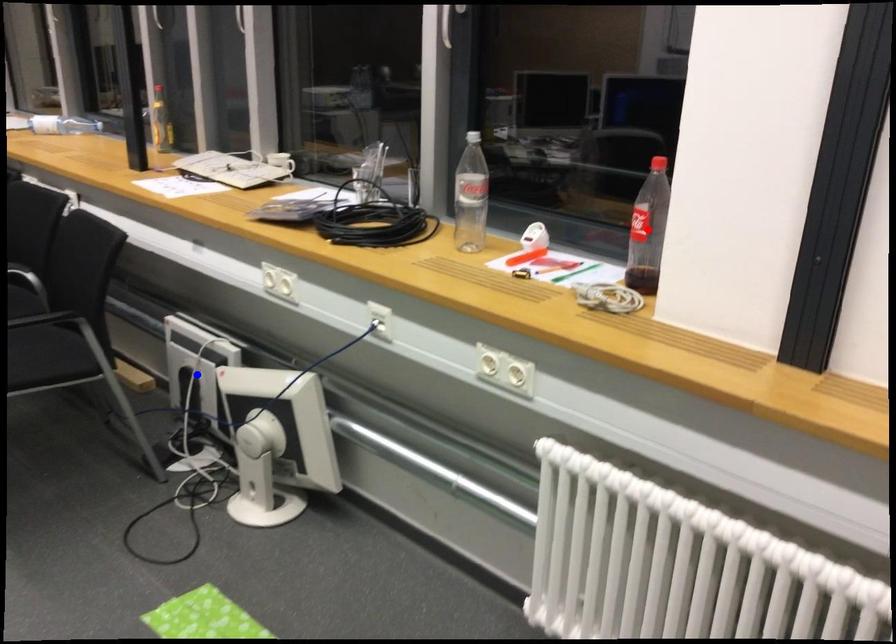
Question: In the image, two points are highlighted. Which point is nearer to the camera? Reply with the corresponding letter.

Choices:
 (A) blue point
 (B) red point

Answer: (B)